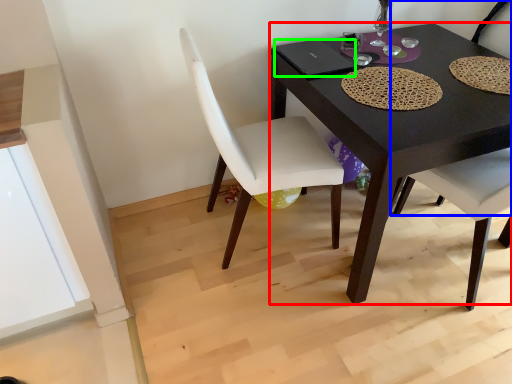
Question: Which object is the closest to the desk (highlighted by a red box)? Choose among these: chair (highlighted by a blue box) or laptop (highlighted by a green box).

Choices:
 (A) chair
 (B) laptop

Answer: (B)